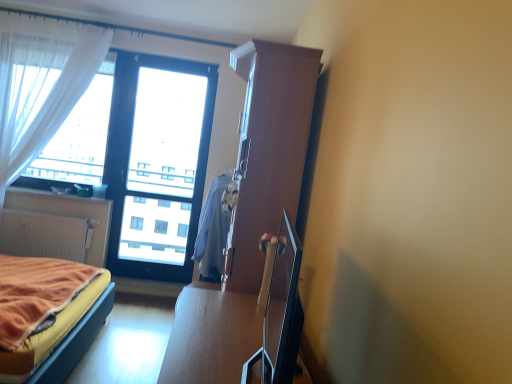
Question: Does transparent glass window at center have a larger size compared to white sheer curtain at left?

Choices:
 (A) no
 (B) yes

Answer: (B)

Question: From the image's perspective, is transparent glass window at center located beneath white sheer curtain at left?

Choices:
 (A) no
 (B) yes

Answer: (B)

Question: From a real-world perspective, does transparent glass window at center sit lower than white sheer curtain at left?

Choices:
 (A) yes
 (B) no

Answer: (A)

Question: Can you see transparent glass window at center touching white sheer curtain at left?

Choices:
 (A) yes
 (B) no

Answer: (B)

Question: Does transparent glass window at center contain white sheer curtain at left?

Choices:
 (A) no
 (B) yes

Answer: (A)

Question: From a real-world perspective, is matte white radiator at lower left physically located above or below velvet orange bed at lower left?

Choices:
 (A) below
 (B) above

Answer: (B)

Question: Considering their positions, is matte white radiator at lower left located in front of or behind velvet orange bed at lower left?

Choices:
 (A) behind
 (B) front

Answer: (A)

Question: Considering the positions of matte white radiator at lower left and velvet orange bed at lower left in the image, is matte white radiator at lower left wider or thinner than velvet orange bed at lower left?

Choices:
 (A) thin
 (B) wide

Answer: (A)

Question: Is point (59, 233) positioned closer to the camera than point (76, 317)?

Choices:
 (A) farther
 (B) closer

Answer: (A)

Question: From the image's perspective, is transparent glass window at center positioned above or below light blue fabric at center?

Choices:
 (A) above
 (B) below

Answer: (A)

Question: Relative to light blue fabric at center, is transparent glass window at center in front or behind?

Choices:
 (A) behind
 (B) front

Answer: (A)

Question: Would you say transparent glass window at center is to the left or to the right of light blue fabric at center in the picture?

Choices:
 (A) right
 (B) left

Answer: (B)

Question: Considering the positions of transparent glass window at center and light blue fabric at center in the image, is transparent glass window at center wider or thinner than light blue fabric at center?

Choices:
 (A) thin
 (B) wide

Answer: (A)

Question: Considering the positions of light blue fabric at center and white sheer curtain at left in the image, is light blue fabric at center taller or shorter than white sheer curtain at left?

Choices:
 (A) tall
 (B) short

Answer: (B)

Question: Considering the positions of light blue fabric at center and white sheer curtain at left in the image, is light blue fabric at center wider or thinner than white sheer curtain at left?

Choices:
 (A) wide
 (B) thin

Answer: (A)